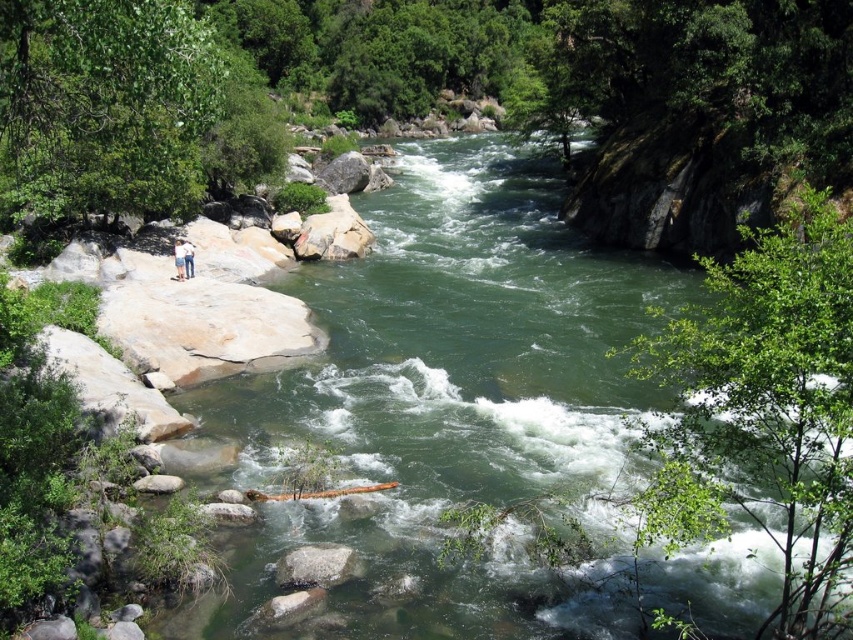
You are a hiker who wants to place both the light brown leather jacket at upper left and the blue jeans at lower left into a backpack compartment that can only hold items narrower than 12 inches. Based on their widths, can both items fit?

The light brown leather jacket at upper left might be wider than blue jeans at lower left. Since the backpack compartment can only hold items narrower than 12 inches, it is uncertain if both can fit without knowing their exact widths.

You are a hiker standing at the edge of the river. You want to take a photo of the green smooth water at center and the light brown leather jacket at upper left. Which object should you focus on first to ensure both are in clear view?

You should focus on the green smooth water at center first because it is closer to the viewer than the light brown leather jacket at upper left, ensuring both will be in focus when starting with the closer object.